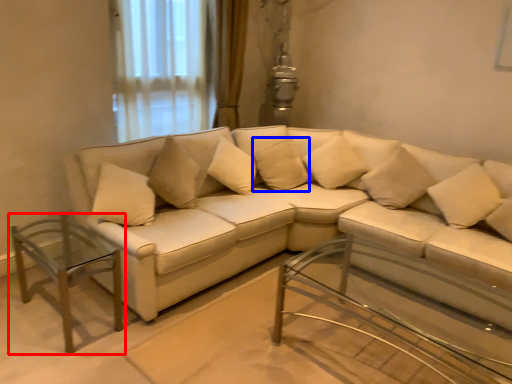
Question: Which point is closer to the camera, table (highlighted by a red box) or pillow (highlighted by a blue box)?

Choices:
 (A) table
 (B) pillow

Answer: (A)